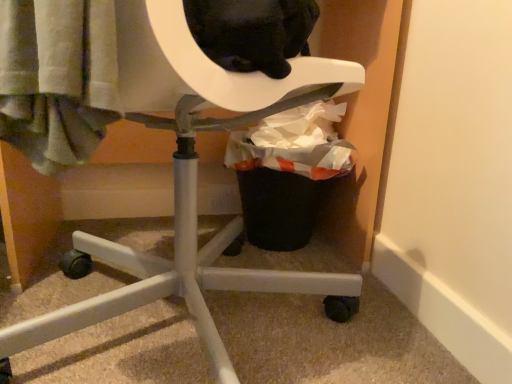
Question: Is point (342, 105) positioned closer to the camera than point (66, 23)?

Choices:
 (A) closer
 (B) farther

Answer: (B)

Question: Based on their sizes in the image, would you say black plastic trash can at lower right is bigger or smaller than white plastic chair at center?

Choices:
 (A) big
 (B) small

Answer: (B)

Question: Is black plastic trash can at lower right to the left or to the right of white plastic chair at center in the image?

Choices:
 (A) right
 (B) left

Answer: (A)

Question: Would you say white plastic chair at center is to the left or to the right of black plastic trash can at lower right in the picture?

Choices:
 (A) left
 (B) right

Answer: (A)

Question: Is point (211, 259) closer or farther from the camera than point (269, 190)?

Choices:
 (A) closer
 (B) farther

Answer: (A)

Question: From the image's perspective, is white plastic chair at center positioned above or below black plastic trash can at lower right?

Choices:
 (A) below
 (B) above

Answer: (A)

Question: Looking at the image, does white plastic chair at center seem bigger or smaller compared to black plastic trash can at lower right?

Choices:
 (A) big
 (B) small

Answer: (A)